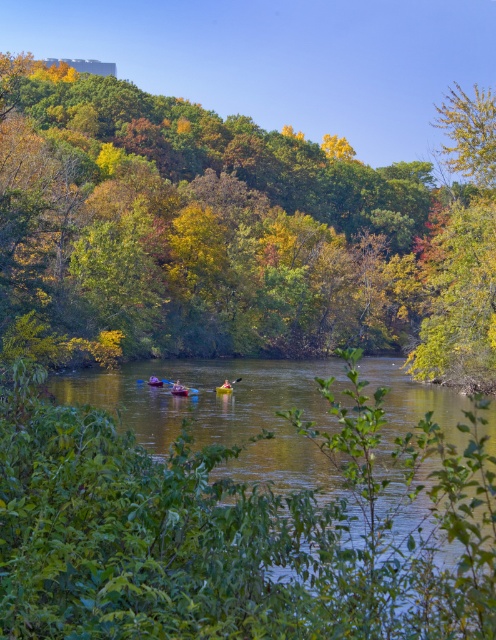
You are standing at the riverside and notice a point marked at coordinates (321, 506). What is located at that point?

The point at coordinates (321, 506) marks green smooth water at center.

You are a photographer trying to capture the green leafy tree at center and the wooden paddle at center in the same frame. Which object should you focus on first if you want to ensure both are in focus without adjusting your camera settings?

The green leafy tree at center has a larger width than the wooden paddle at center, so focusing on the larger object first will help ensure both are in focus.

You are a hiker who wants to retrieve the wooden paddle at center from the river. However, there is a green leafy tree at center in your way. Can you reach the paddle without moving the tree?

The green leafy tree at center is positioned over the wooden paddle at center, so you cannot reach the paddle without moving the tree.